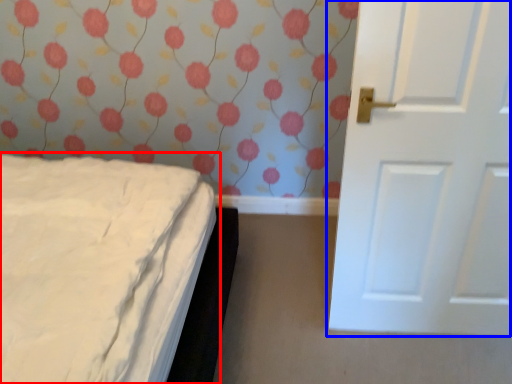
Question: Which point is closer to the camera, bed (highlighted by a red box) or door (highlighted by a blue box)?

Choices:
 (A) bed
 (B) door

Answer: (A)